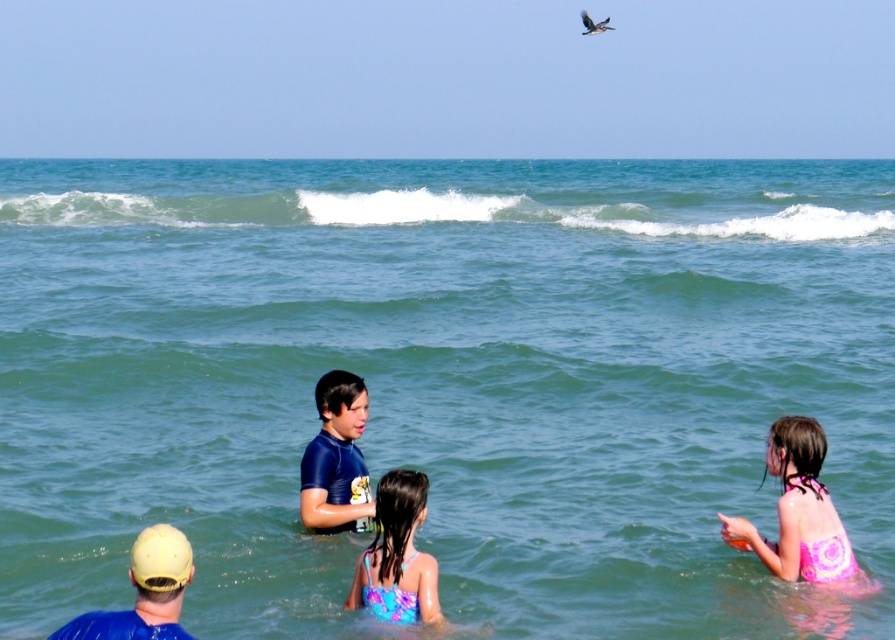
You are a photographer trying to capture a clear shot of the multicolored swimsuit at center and the blue fabric cap at lower left. Which object should you zoom in on to avoid blurring due to their sizes in the frame?

The multicolored swimsuit at center is thinner than the blue fabric cap at lower left, so you should zoom in on the multicolored swimsuit at center to avoid blurring since it is smaller and might be harder to capture clearly.